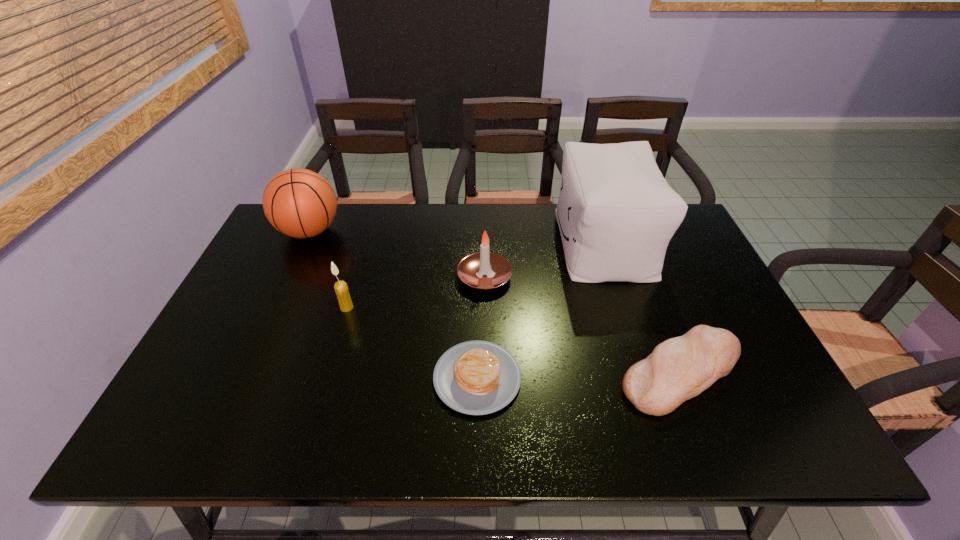
This screenshot has width=960, height=540. I want to click on blank region between the cushion and the bread, so click(643, 308).

Where is `object that ranks as the second closest to the bread`? Image resolution: width=960 pixels, height=540 pixels. object that ranks as the second closest to the bread is located at coordinates (476, 377).

Locate an element on the screen. object that can be found as the closest to the bread is located at coordinates (616, 213).

Where is `vacant space that satisfies the following two spatial constraints: 1. on the side of the bread with the smiley face; 2. on the right side of the tallest object`? The image size is (960, 540). vacant space that satisfies the following two spatial constraints: 1. on the side of the bread with the smiley face; 2. on the right side of the tallest object is located at coordinates (646, 373).

Locate an element on the screen. The height and width of the screenshot is (540, 960). free spot that satisfies the following two spatial constraints: 1. on the front side of the basketball; 2. on the left side of the second object from left to right is located at coordinates (275, 307).